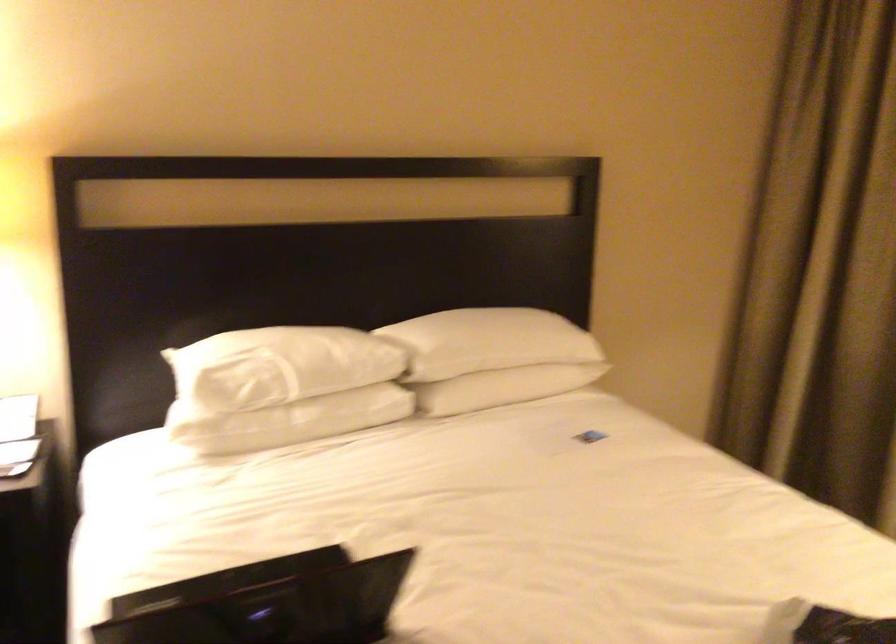
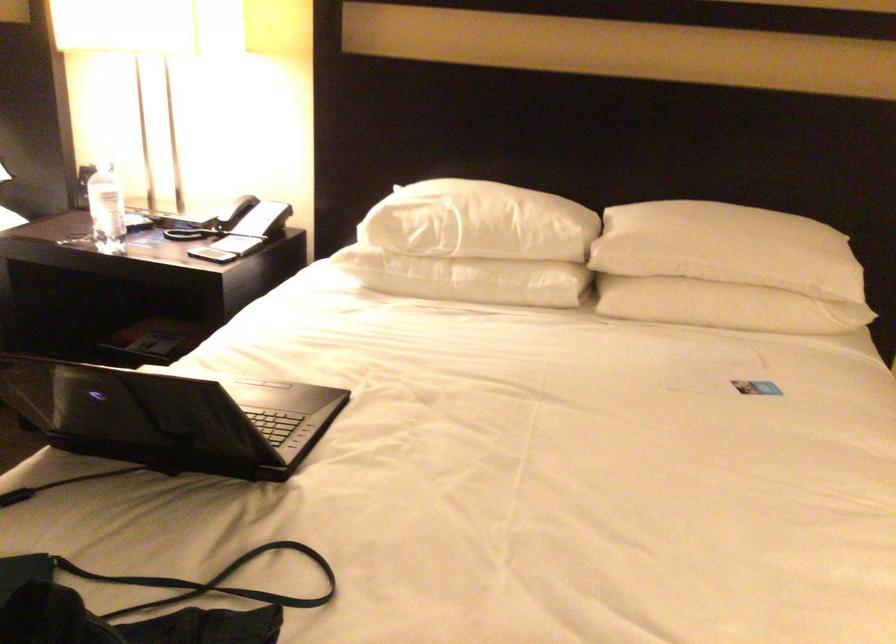
In the second image, find the point that corresponds to point 303,386 in the first image.

(474, 245)